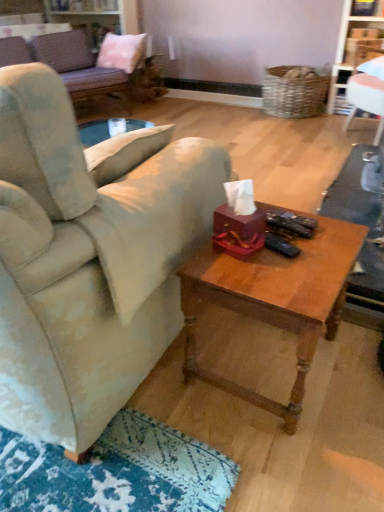
The image size is (384, 512). In order to click on free space in front of wooden coffee table at center in this screenshot , I will do `click(272, 458)`.